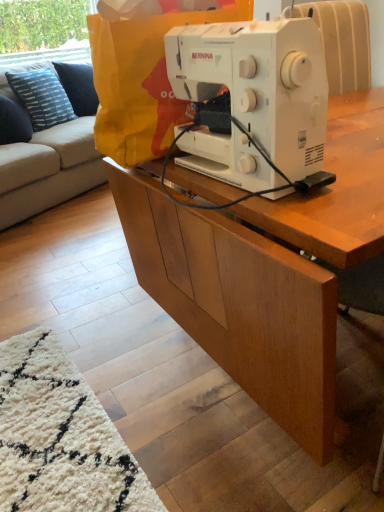
Question: Visually, is white plastic sewing machine at center positioned to the left or to the right of blue striped fabric pillow at upper left?

Choices:
 (A) left
 (B) right

Answer: (B)

Question: Is white plastic sewing machine at center in front of or behind blue striped fabric pillow at upper left in the image?

Choices:
 (A) front
 (B) behind

Answer: (A)

Question: Estimate the real-world distances between objects in this image. Which object is closer to the blue striped fabric pillow at upper left?

Choices:
 (A) light gray fabric couch at upper left
 (B) white plastic sewing machine at center
 (C) yellow paper bag at center
 (D) wooden cabinet at center

Answer: (A)

Question: Which object is positioned closest to the light gray fabric couch at upper left?

Choices:
 (A) yellow paper bag at center
 (B) wooden cabinet at center
 (C) blue striped fabric pillow at upper left
 (D) white plastic sewing machine at center

Answer: (C)